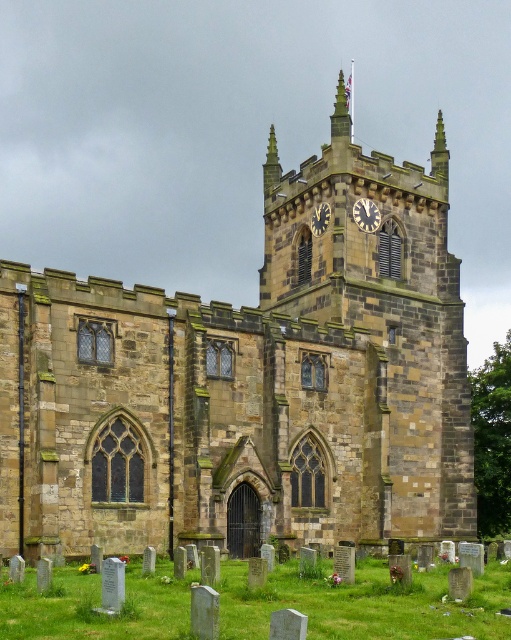
You are standing in front of the historic stone church and want to take a photo of the gold textured clock at upper center. However, you notice the brown stone clock tower at center might be blocking your view. Based on their positions, can you determine if the tower is obscuring the clock?

The brown stone clock tower at center is positioned over the gold textured clock at upper center, so the tower is blocking the view of the clock.